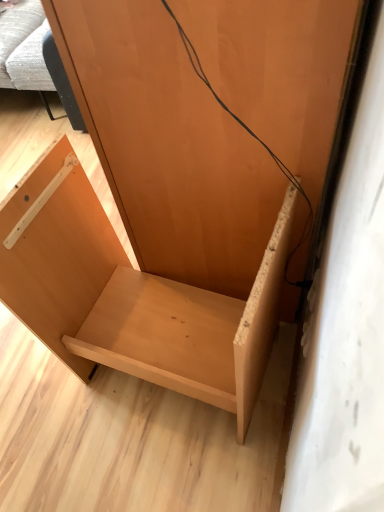
What do you see at coordinates (130, 294) in the screenshot?
I see `light wood shelf at lower left` at bounding box center [130, 294].

I want to click on light wood shelf at lower left, so click(x=130, y=294).

Measure the distance between point (36, 226) and camera.

They are 3.38 feet apart.

Image resolution: width=384 pixels, height=512 pixels. I want to click on light wood shelf at lower left, so click(x=130, y=294).